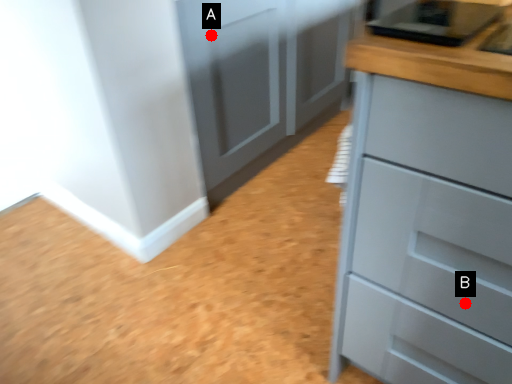
Question: Two points are circled on the image, labeled by A and B beside each circle. Which point is closer to the camera?

Choices:
 (A) A is closer
 (B) B is closer

Answer: (B)